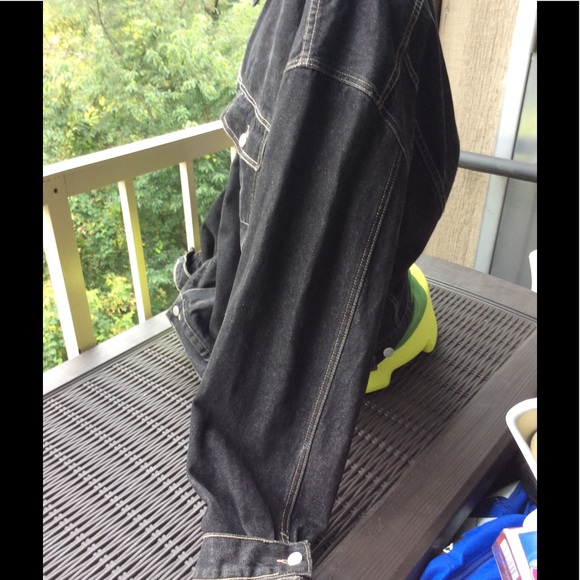
Locate an element on the screen. bowl is located at coordinates (423, 338).